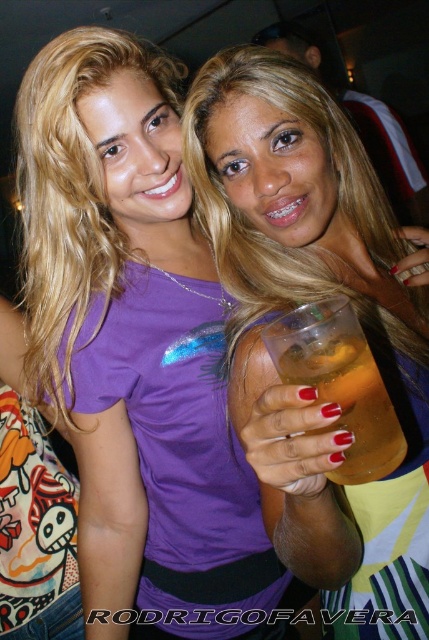
You are a bartender at a party and need to place a new drink order for the guests. The guests are standing in the scene described. Where should you place the new drink so that it is closest to the existing matte plastic cup at center?

The new drink should be placed near the position of the matte plastic cup at center at point [307,301] to ensure it is closest to the existing cup.

You are at a party and want to choose a cup to drink from. Both the matte plastic cup at center and the translucent plastic cup at center are available. Which cup is taller?

The matte plastic cup at center is taller than the translucent plastic cup at center according to the description.